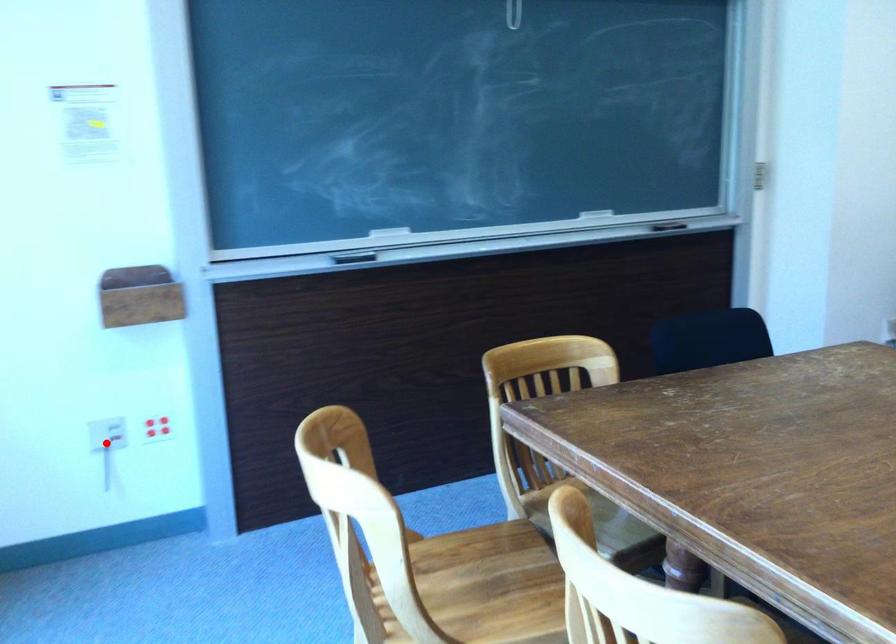
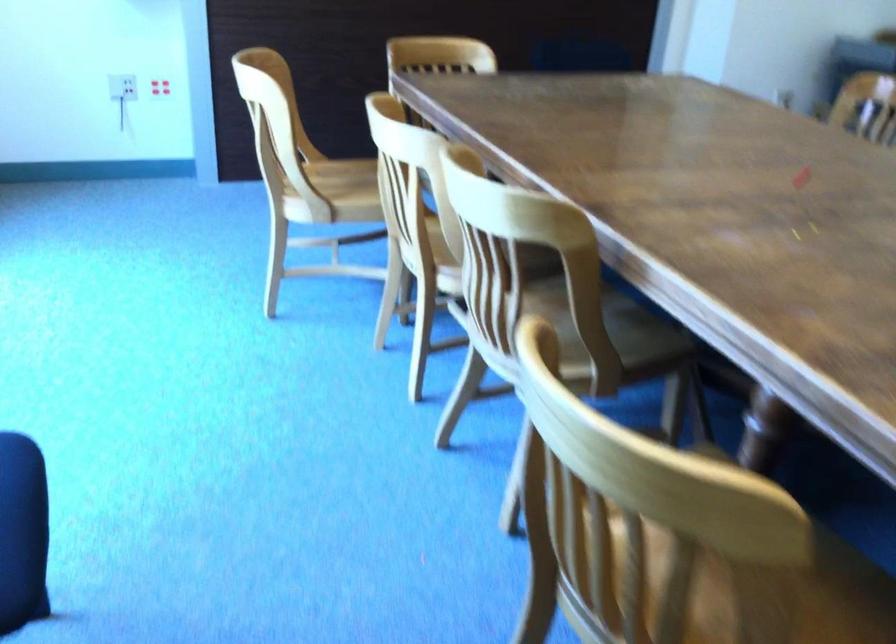
Where in the second image is the point corresponding to the highlighted location from the first image?

(122, 87)